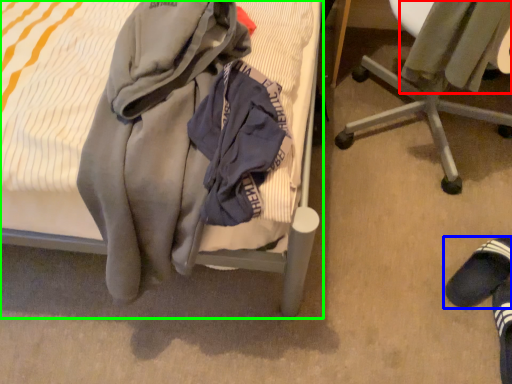
Question: Which object is positioned closest to sweater (highlighted by a red box)? Select from footwear (highlighted by a blue box) and bed (highlighted by a green box).

Choices:
 (A) footwear
 (B) bed

Answer: (B)